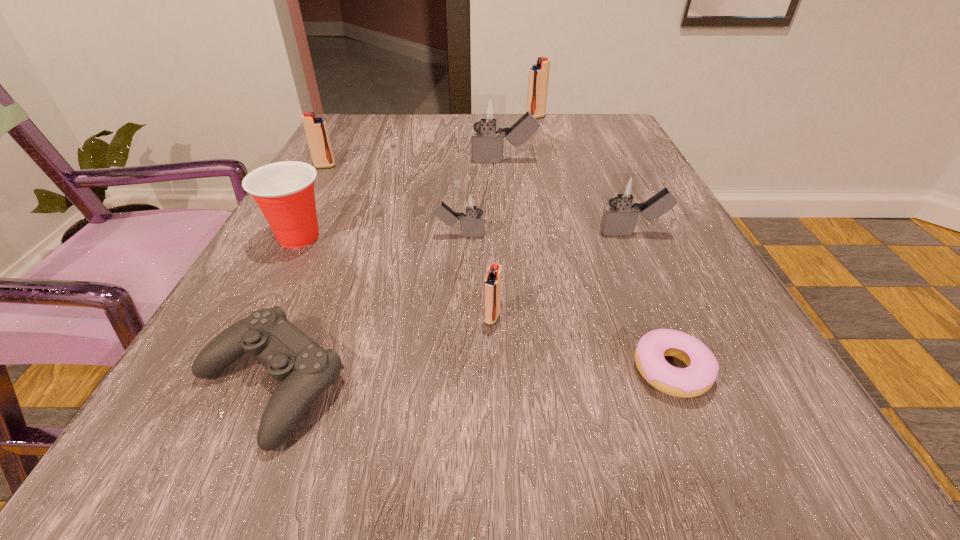
Identify the location of vacant space located on the left of the nearest igniter. (350, 318).

At what (x,y) coordinates should I click in order to perform the action: click on free space located 0.170m on the left of the smallest gray igniter. Please return your answer as a coordinate pair (x, y). The width and height of the screenshot is (960, 540). Looking at the image, I should click on (339, 235).

Image resolution: width=960 pixels, height=540 pixels. In order to click on vacant region located on the back of the control in this screenshot , I will do `click(330, 243)`.

Identify the location of vacant area located 0.390m on the back of the doughnut. The image size is (960, 540). pyautogui.click(x=600, y=193).

This screenshot has width=960, height=540. What are the coordinates of `object that is at the near edge` in the screenshot? It's located at (305, 370).

Find the location of `igniter at the left edge`. igniter at the left edge is located at coordinates (316, 131).

Image resolution: width=960 pixels, height=540 pixels. In order to click on cup situated at the left edge in this screenshot , I will do `click(284, 191)`.

Where is `control located in the left edge section of the desktop`? The width and height of the screenshot is (960, 540). control located in the left edge section of the desktop is located at coordinates (305, 370).

Where is `igniter that is at the right edge`? The image size is (960, 540). igniter that is at the right edge is located at coordinates (619, 218).

This screenshot has height=540, width=960. What are the coordinates of `doughnut at the right edge` in the screenshot? It's located at (702, 369).